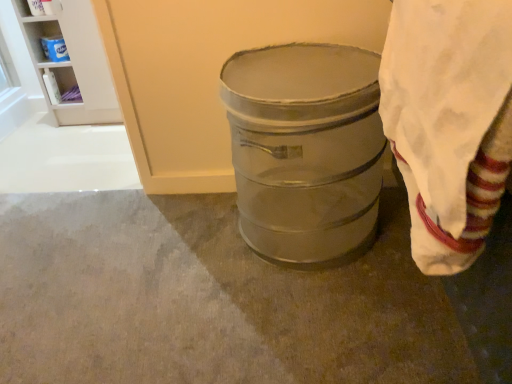
What do you see at coordinates (208, 299) in the screenshot?
I see `metallic gray barrel at center` at bounding box center [208, 299].

This screenshot has width=512, height=384. What do you see at coordinates (305, 149) in the screenshot? I see `metallic gray trash can at center` at bounding box center [305, 149].

What are the coordinates of `white glossy shelf at upper left, positioned as the second shelf in right-to-left order` in the screenshot? It's located at coord(59,90).

You are a GUI agent. You are given a task and a screenshot of the screen. Output one action in this format:
    pyautogui.click(x=<x>, y=<y>)
    Task: Click on the white cotton cloth at right
    This screenshot has width=512, height=384.
    Given the screenshot: What is the action you would take?
    pyautogui.click(x=449, y=122)

The width and height of the screenshot is (512, 384). I want to click on metallic gray barrel at center, so click(x=208, y=299).

From the image's perspective, does white glossy shelf at upper left, which is counted as the first shelf, starting from the left, appear lower than metallic gray barrel at center?

Actually, white glossy shelf at upper left, which is counted as the first shelf, starting from the left, appears above metallic gray barrel at center in the image.

Considering the relative positions of white glossy shelf at upper left, which is counted as the first shelf, starting from the left, and metallic gray barrel at center in the image provided, is white glossy shelf at upper left, which is counted as the first shelf, starting from the left, behind metallic gray barrel at center?

Yes, white glossy shelf at upper left, which is counted as the first shelf, starting from the left, is further from the viewer.

Between white glossy shelf at upper left, positioned as the second shelf in right-to-left order, and metallic gray barrel at center, which one has smaller width?

white glossy shelf at upper left, positioned as the second shelf in right-to-left order.

From the picture: Is white glossy shelf at upper left, which is counted as the first shelf, starting from the left, in contact with metallic gray barrel at center?

No, white glossy shelf at upper left, which is counted as the first shelf, starting from the left, is not next to metallic gray barrel at center.

Is metallic gray barrel at center wider than white plastic shelf at upper left, which is counted as the first shelf, starting from the right?

Yes, metallic gray barrel at center is wider than white plastic shelf at upper left, which is counted as the first shelf, starting from the right.

Is metallic gray barrel at center not within white plastic shelf at upper left, which is counted as the first shelf, starting from the right?

Yes, metallic gray barrel at center is not within white plastic shelf at upper left, which is counted as the first shelf, starting from the right.

From their relative heights in the image, would you say metallic gray barrel at center is taller or shorter than white plastic shelf at upper left, which is counted as the first shelf, starting from the right?

Considering their sizes, metallic gray barrel at center has less height than white plastic shelf at upper left, which is counted as the first shelf, starting from the right.

From a real-world perspective, relative to white plastic shelf at upper left, marked as the second shelf in a left-to-right arrangement, is metallic gray barrel at center vertically above or below?

From a real-world perspective, metallic gray barrel at center is physically below white plastic shelf at upper left, marked as the second shelf in a left-to-right arrangement.

How far apart are white cotton cloth at right and metallic gray trash can at center?

white cotton cloth at right and metallic gray trash can at center are 14.38 inches apart from each other.

Is white cotton cloth at right wider than metallic gray trash can at center?

In fact, white cotton cloth at right might be narrower than metallic gray trash can at center.

Does white cotton cloth at right appear on the right side of metallic gray trash can at center?

Indeed, white cotton cloth at right is positioned on the right side of metallic gray trash can at center.

Find the location of a particular element. Image resolution: width=512 pixels, height=384 pixels. cloth above the metallic gray trash can at center (from a real-world perspective) is located at coordinates (449, 122).

Which object is positioned more to the left, white cotton cloth at right or metallic gray barrel at center?

A: Positioned to the left is metallic gray barrel at center.

From a real-world perspective, is white cotton cloth at right positioned over metallic gray barrel at center based on gravity?

Yes, from a real-world perspective, white cotton cloth at right is on top of metallic gray barrel at center.

Locate an element on the screen. concrete below the white cotton cloth at right (from a real-world perspective) is located at coordinates (208, 299).

Considering the relative sizes of white cotton cloth at right and metallic gray barrel at center in the image provided, is white cotton cloth at right shorter than metallic gray barrel at center?

No.

Would you say metallic gray trash can at center is outside white cotton cloth at right?

Yes.

Is metallic gray trash can at center oriented away from white cotton cloth at right?

No, metallic gray trash can at center is not facing the opposite direction of white cotton cloth at right.

Which object is positioned more to the left, metallic gray trash can at center or white cotton cloth at right?

From the viewer's perspective, metallic gray trash can at center appears more on the left side.

Does white plastic shelf at upper left, which is counted as the first shelf, starting from the right, contain metallic gray trash can at center?

Actually, metallic gray trash can at center is outside white plastic shelf at upper left, which is counted as the first shelf, starting from the right.

Between white plastic shelf at upper left, which is counted as the first shelf, starting from the right, and metallic gray trash can at center, which one has larger width?

With larger width is metallic gray trash can at center.

From the image's perspective, is white plastic shelf at upper left, marked as the second shelf in a left-to-right arrangement, above or below metallic gray trash can at center?

Based on their image positions, white plastic shelf at upper left, marked as the second shelf in a left-to-right arrangement, is located above metallic gray trash can at center.

Is white glossy shelf at upper left, positioned as the second shelf in right-to-left order, beside metallic gray trash can at center?

No, white glossy shelf at upper left, positioned as the second shelf in right-to-left order, is not making contact with metallic gray trash can at center.

How many degrees apart are the facing directions of white glossy shelf at upper left, positioned as the second shelf in right-to-left order, and metallic gray trash can at center?

They differ by 4.3 degrees in their facing directions.

Does white glossy shelf at upper left, which is counted as the first shelf, starting from the left, have a greater height compared to metallic gray trash can at center?

In fact, white glossy shelf at upper left, which is counted as the first shelf, starting from the left, may be shorter than metallic gray trash can at center.

Which of these two, white glossy shelf at upper left, which is counted as the first shelf, starting from the left, or metallic gray trash can at center, is smaller?

Smaller between the two is white glossy shelf at upper left, which is counted as the first shelf, starting from the left.

Image resolution: width=512 pixels, height=384 pixels. In order to click on concrete below the white glossy shelf at upper left, positioned as the second shelf in right-to-left order (from the image's perspective) in this screenshot , I will do `click(208, 299)`.

Starting from the metallic gray barrel at center, which shelf is the 1st one to the left? Please provide its 2D coordinates.

[(72, 63)]

Based on their spatial positions, is white cotton cloth at right or white glossy shelf at upper left, positioned as the second shelf in right-to-left order, further from metallic gray barrel at center?

Among the two, white glossy shelf at upper left, positioned as the second shelf in right-to-left order, is located further to metallic gray barrel at center.

When comparing their distances from white glossy shelf at upper left, positioned as the second shelf in right-to-left order, does white plastic shelf at upper left, marked as the second shelf in a left-to-right arrangement, or metallic gray trash can at center seem closer?

white plastic shelf at upper left, marked as the second shelf in a left-to-right arrangement.

Based on their spatial positions, is white glossy shelf at upper left, positioned as the second shelf in right-to-left order, or metallic gray barrel at center further from metallic gray trash can at center?

The object further to metallic gray trash can at center is white glossy shelf at upper left, positioned as the second shelf in right-to-left order.

Looking at this image, considering their positions, is metallic gray barrel at center positioned closer to white glossy shelf at upper left, which is counted as the first shelf, starting from the left, than metallic gray trash can at center?

metallic gray barrel at center.

When comparing their distances from white cotton cloth at right, does white plastic shelf at upper left, marked as the second shelf in a left-to-right arrangement, or metallic gray barrel at center seem further?

white plastic shelf at upper left, marked as the second shelf in a left-to-right arrangement.

Based on their spatial positions, is metallic gray trash can at center or white cotton cloth at right further from metallic gray barrel at center?

white cotton cloth at right.

From the image, which object appears to be nearer to metallic gray barrel at center, white plastic shelf at upper left, which is counted as the first shelf, starting from the right, or white cotton cloth at right?

white cotton cloth at right lies closer to metallic gray barrel at center than the other object.

Based on their spatial positions, is white glossy shelf at upper left, positioned as the second shelf in right-to-left order, or metallic gray trash can at center closer to metallic gray barrel at center?

Based on the image, metallic gray trash can at center appears to be nearer to metallic gray barrel at center.

Locate an element on the screen. This screenshot has width=512, height=384. concrete positioned between metallic gray trash can at center and white glossy shelf at upper left, positioned as the second shelf in right-to-left order, from near to far is located at coordinates (208, 299).

The width and height of the screenshot is (512, 384). In order to click on concrete between white cotton cloth at right and white glossy shelf at upper left, positioned as the second shelf in right-to-left order, in the front-back direction in this screenshot , I will do `click(208, 299)`.

Find the location of a particular element. shelf between white cotton cloth at right and white glossy shelf at upper left, positioned as the second shelf in right-to-left order, from front to back is located at coordinates (72, 63).

At what (x,y) coordinates should I click in order to perform the action: click on waste container between white cotton cloth at right and white glossy shelf at upper left, which is counted as the first shelf, starting from the left, from front to back. Please return your answer as a coordinate pair (x, y). This screenshot has height=384, width=512. Looking at the image, I should click on (305, 149).